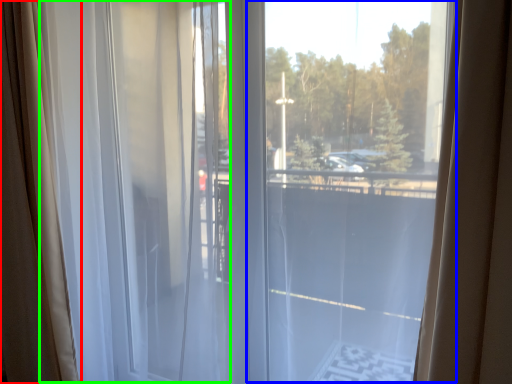
Question: Which is nearer to the curtain (highlighted by a red box)? glass window (highlighted by a blue box) or curtain (highlighted by a green box).

Choices:
 (A) glass window
 (B) curtain

Answer: (B)